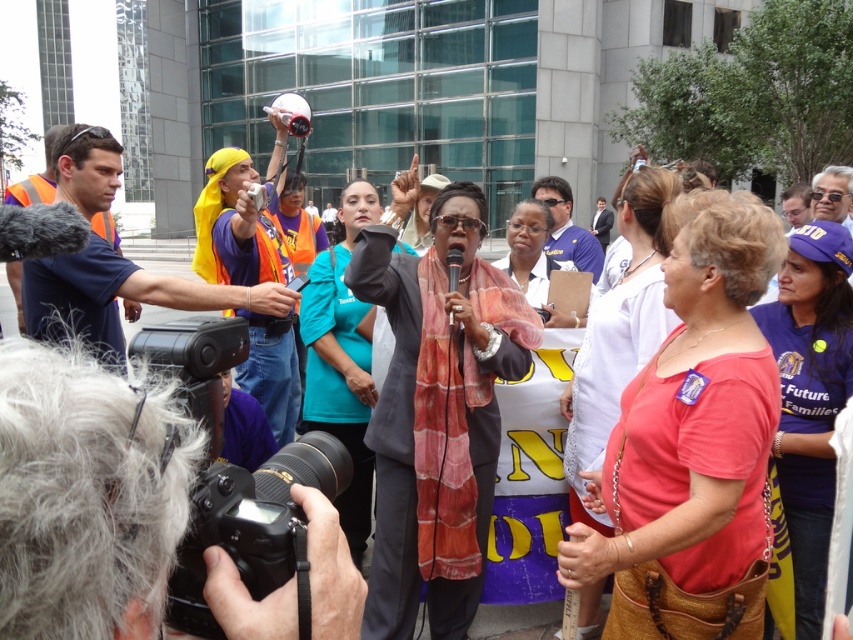
You are a photographer at the protest scene. You have a black plastic camera at lower left and a blue fabric shirt at center in your viewfinder. Which object is nearer to you?

The black plastic camera at lower left is closer to the viewer than the blue fabric shirt at center.

You are a photographer at the protest event. You have two cameras available, the black digital camera at lower left and the black plastic camera at lower left. Which camera is more accessible to you for immediate use?

The black digital camera at lower left is closer to the viewer than the black plastic camera at lower left, so it is more accessible for immediate use.

You are a photographer trying to capture the speaker at the protest. You have a black digital camera at lower left and a blue fabric shirt at center. Which object is smaller in size?

The black digital camera at lower left is smaller than the blue fabric shirt at center according to the description.